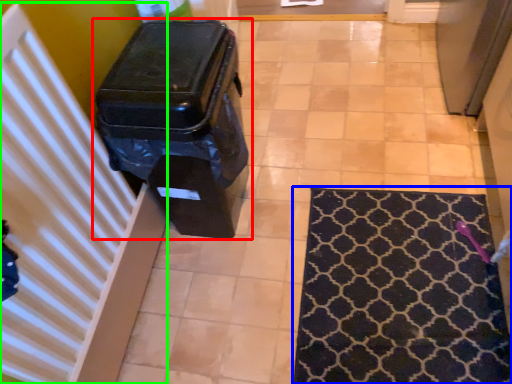
Question: Which object is positioned closest to waste container (highlighted by a red box)? Select from mat (highlighted by a blue box) and radiator (highlighted by a green box).

Choices:
 (A) mat
 (B) radiator

Answer: (B)